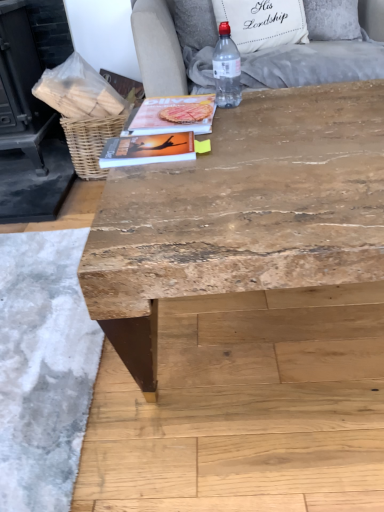
This screenshot has width=384, height=512. Find the location of `vacant region under natural wood table at center (from a real-world perspective)`. vacant region under natural wood table at center (from a real-world perspective) is located at coordinates (275, 333).